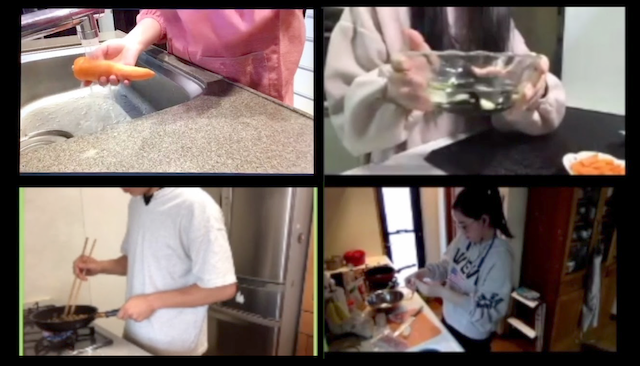
The image size is (640, 366). In order to click on window in this screenshot , I will do click(x=399, y=219).